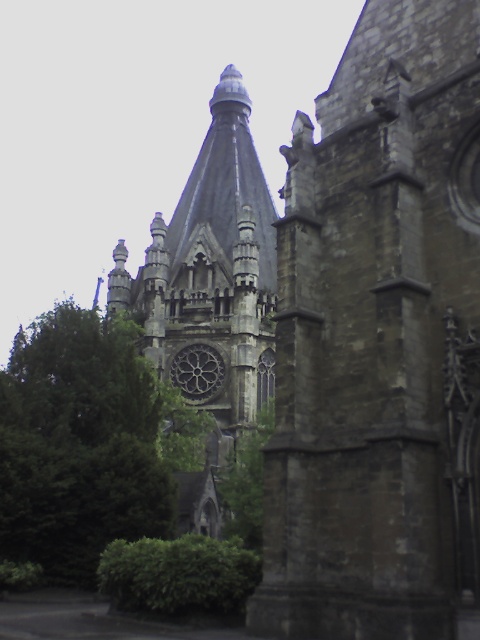
Question: Does dark stone tower at center have a greater width compared to green leafy tree at left?

Choices:
 (A) yes
 (B) no

Answer: (B)

Question: From the image, what is the correct spatial relationship of dark stone tower at center in relation to green leafy tree at left?

Choices:
 (A) above
 (B) below

Answer: (A)

Question: Among these objects, which one is nearest to the camera?

Choices:
 (A) green leafy tree at left
 (B) dark stone tower at center

Answer: (B)

Question: Considering the relative positions of dark stone tower at center and green leafy tree at left in the image provided, where is dark stone tower at center located with respect to green leafy tree at left?

Choices:
 (A) above
 (B) below

Answer: (A)